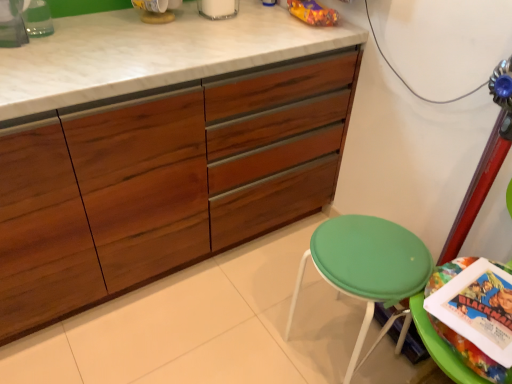
Describe the element at coordinates (167, 174) in the screenshot. I see `wooden cabinet at center` at that location.

The height and width of the screenshot is (384, 512). I want to click on wooden cabinet at center, so click(167, 174).

This screenshot has height=384, width=512. In order to click on wooden cabinet at center in this screenshot , I will do `click(167, 174)`.

Identify the location of stool to the left of green plastic stool at lower right. point(366,265).

Between green plastic stool at lower right and green fabric stool at lower right, which one has smaller size?

Smaller between the two is green plastic stool at lower right.

Is point (449, 342) closer or farther from the camera than point (340, 249)?

Clearly, point (449, 342) is closer to the camera than point (340, 249).

Considering the positions of objects green fabric stool at lower right and wooden cabinet at center in the image provided, who is more to the right, green fabric stool at lower right or wooden cabinet at center?

From the viewer's perspective, green fabric stool at lower right appears more on the right side.

From the image's perspective, is green fabric stool at lower right beneath wooden cabinet at center?

Correct, green fabric stool at lower right appears lower than wooden cabinet at center in the image.

Who is smaller, green fabric stool at lower right or wooden cabinet at center?

With smaller size is green fabric stool at lower right.

Between green fabric stool at lower right and wooden cabinet at center, which one has more height?

wooden cabinet at center.

Is the surface of green plastic stool at lower right in direct contact with wooden cabinet at center?

green plastic stool at lower right and wooden cabinet at center are not in contact.

Relative to wooden cabinet at center, is green plastic stool at lower right in front or behind?

Clearly, green plastic stool at lower right is behind wooden cabinet at center.

Which object is thinner, green plastic stool at lower right or wooden cabinet at center?

Thinner between the two is green plastic stool at lower right.

This screenshot has height=384, width=512. In order to click on swivel chair behind the wooden cabinet at center in this screenshot , I will do `click(454, 336)`.

How distant is wooden cabinet at center from green fabric stool at lower right?

wooden cabinet at center and green fabric stool at lower right are 54.46 centimeters apart from each other.

Considering the points (340, 102) and (332, 222), which point is behind, point (340, 102) or point (332, 222)?

The point (340, 102) is farther.

Is green fabric stool at lower right located within wooden cabinet at center?

No, green fabric stool at lower right is not a part of wooden cabinet at center.

Considering the relative positions of wooden cabinet at center and green fabric stool at lower right in the image provided, is wooden cabinet at center behind green fabric stool at lower right?

No, wooden cabinet at center is closer to the camera.

From the image's perspective, would you say green fabric stool at lower right is shown under green plastic stool at lower right?

Correct, green fabric stool at lower right appears lower than green plastic stool at lower right in the image.

Considering the sizes of green fabric stool at lower right and green plastic stool at lower right in the image, is green fabric stool at lower right bigger or smaller than green plastic stool at lower right?

Clearly, green fabric stool at lower right is larger in size than green plastic stool at lower right.

From a real-world perspective, between green fabric stool at lower right and green plastic stool at lower right, who is vertically higher?

green plastic stool at lower right is physically above.

Does point (362, 338) come farther from viewer compared to point (488, 374)?

Yes, it is behind point (488, 374).

From a real-world perspective, is wooden cabinet at center positioned above or below green plastic stool at lower right?

wooden cabinet at center is situated lower than green plastic stool at lower right in the real world.

Does wooden cabinet at center have a smaller size compared to green plastic stool at lower right?

No, wooden cabinet at center is not smaller than green plastic stool at lower right.

Is wooden cabinet at center facing towards green plastic stool at lower right?

Yes, wooden cabinet at center faces towards green plastic stool at lower right.

Is point (137, 263) positioned before point (495, 368)?

That is False.

Where is `stool below the green plastic stool at lower right (from the image's perspective)`? stool below the green plastic stool at lower right (from the image's perspective) is located at coordinates (366, 265).

This screenshot has width=512, height=384. What are the coordinates of `stool on the right of the wooden cabinet at center` in the screenshot? It's located at coord(366,265).

Looking at the image, which one is located further to green fabric stool at lower right, green plastic stool at lower right or wooden cabinet at center?

The object further to green fabric stool at lower right is wooden cabinet at center.

Looking at the image, which one is located further to green plastic stool at lower right, green fabric stool at lower right or wooden cabinet at center?

wooden cabinet at center.

Looking at the image, which one is located closer to green fabric stool at lower right, wooden cabinet at center or green plastic stool at lower right?

Among the two, green plastic stool at lower right is located nearer to green fabric stool at lower right.

Based on their spatial positions, is green fabric stool at lower right or green plastic stool at lower right further from wooden cabinet at center?

Among the two, green plastic stool at lower right is located further to wooden cabinet at center.

Looking at this image, considering their positions, is wooden cabinet at center positioned further to green plastic stool at lower right than green fabric stool at lower right?

wooden cabinet at center is positioned further to the anchor green plastic stool at lower right.

Based on their spatial positions, is green plastic stool at lower right or green fabric stool at lower right closer to wooden cabinet at center?

green fabric stool at lower right.

At what (x,y) coordinates should I click in order to perform the action: click on stool between wooden cabinet at center and green plastic stool at lower right from left to right. Please return your answer as a coordinate pair (x, y). The image size is (512, 384). Looking at the image, I should click on pyautogui.click(x=366, y=265).